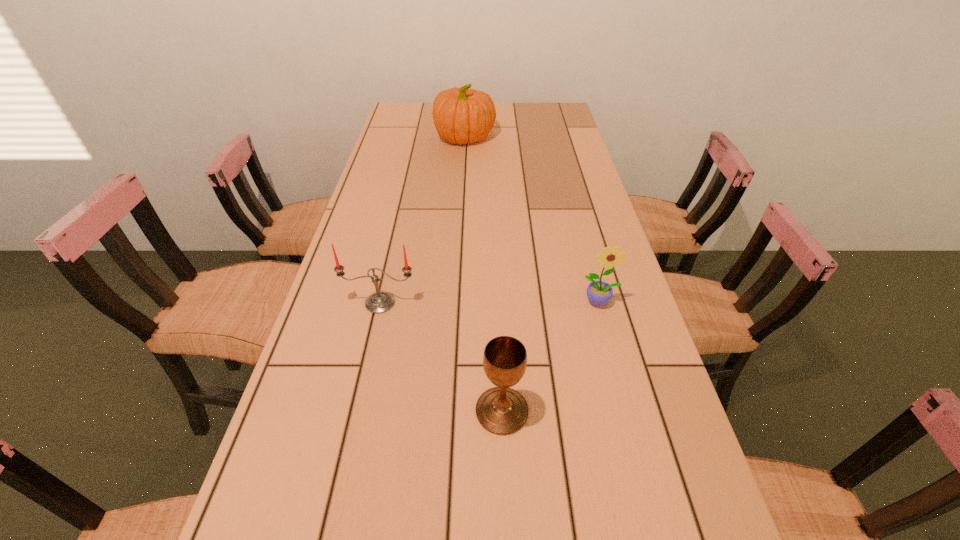
Image resolution: width=960 pixels, height=540 pixels. In order to click on object located at the right edge in this screenshot , I will do `click(599, 293)`.

Locate an element on the screen. The image size is (960, 540). free point at the far edge is located at coordinates (521, 127).

Locate an element on the screen. Image resolution: width=960 pixels, height=540 pixels. blank area at the left edge is located at coordinates (347, 260).

In the image, there is a desktop. Where is `blank space at the right edge`? The image size is (960, 540). blank space at the right edge is located at coordinates (563, 166).

This screenshot has height=540, width=960. I want to click on vacant space at the far right corner of the desktop, so click(557, 110).

Where is `empty space between the chalice and the candle`? This screenshot has height=540, width=960. empty space between the chalice and the candle is located at coordinates (441, 357).

At what (x,y) coordinates should I click in order to perform the action: click on unoccupied area between the nearest object and the sunflower. Please return your answer as a coordinate pair (x, y). The image size is (960, 540). Looking at the image, I should click on (551, 356).

Identify the location of vacant space that's between the candle and the rightmost object. (490, 302).

Find the location of a particular element. The width and height of the screenshot is (960, 540). unoccupied position between the pumpkin and the candle is located at coordinates tap(422, 220).

Where is `free space between the nearest object and the candle`? The image size is (960, 540). free space between the nearest object and the candle is located at coordinates (441, 357).